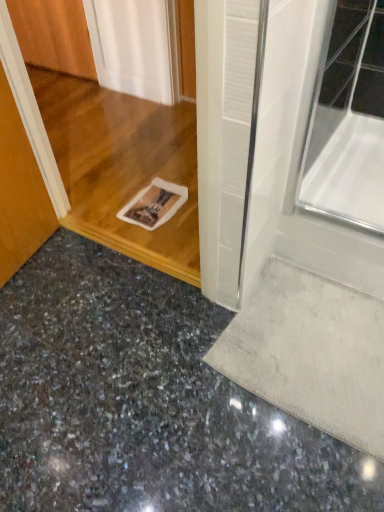
Question: Is white textured mat at lower right taller or shorter than polished granite floor at lower left?

Choices:
 (A) tall
 (B) short

Answer: (B)

Question: Is white textured mat at lower right to the left or to the right of polished granite floor at lower left in the image?

Choices:
 (A) right
 (B) left

Answer: (A)

Question: From a real-world perspective, is white textured mat at lower right positioned above or below polished granite floor at lower left?

Choices:
 (A) below
 (B) above

Answer: (B)

Question: From a real-world perspective, relative to white textured mat at lower right, is polished granite floor at lower left vertically above or below?

Choices:
 (A) above
 (B) below

Answer: (B)

Question: From the image's perspective, is polished granite floor at lower left positioned above or below white textured mat at lower right?

Choices:
 (A) below
 (B) above

Answer: (A)

Question: Is polished granite floor at lower left inside or outside of white textured mat at lower right?

Choices:
 (A) inside
 (B) outside

Answer: (B)

Question: Considering the relative positions of polished granite floor at lower left and white textured mat at lower right in the image provided, is polished granite floor at lower left to the left or to the right of white textured mat at lower right?

Choices:
 (A) right
 (B) left

Answer: (B)